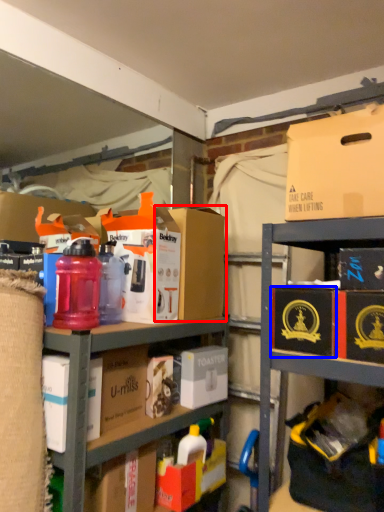
Question: Which object is further to the camera taking this photo, cardboard box (highlighted by a red box) or cardboard box (highlighted by a blue box)?

Choices:
 (A) cardboard box
 (B) cardboard box

Answer: (A)